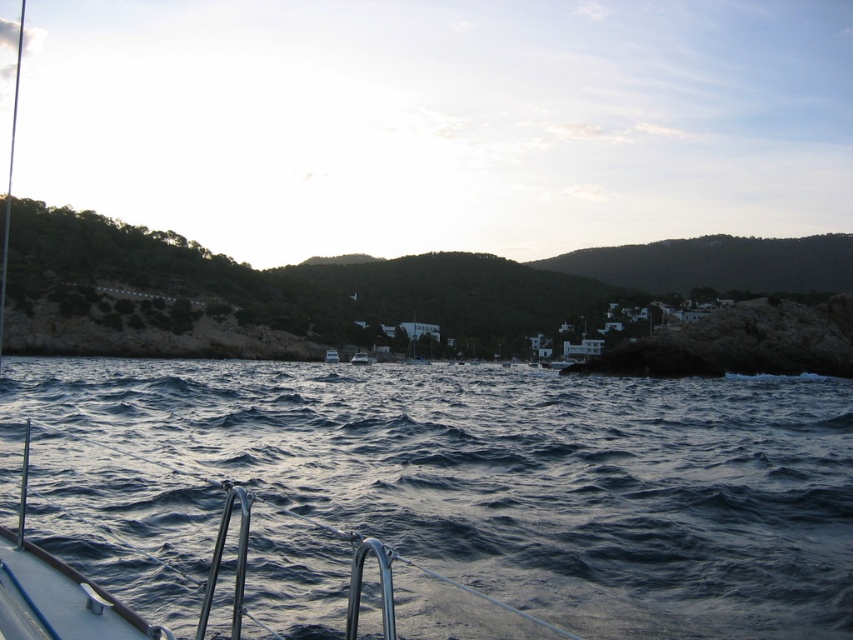
Is point (508, 340) behind point (329, 353)?

Yes, point (508, 340) is behind point (329, 353).

Which is in front, point (491, 312) or point (325, 355)?

Point (325, 355) is more forward.

At what (x,y) coordinates should I click in order to perform the action: click on green grassy hill at upper center. Please return your answer as a coordinate pair (x, y). The height and width of the screenshot is (640, 853). Looking at the image, I should click on (347, 289).

Which of these two, dark blue water at center or green grassy hill at upper center, stands taller?

green grassy hill at upper center is taller.

What are the coordinates of `dark blue water at center` in the screenshot? It's located at (x=512, y=476).

Locate an element on the screen. This screenshot has height=640, width=853. dark blue water at center is located at coordinates (512, 476).

Can you confirm if white glossy boat at center is positioned above metallic silver boat at center?

No, white glossy boat at center is not above metallic silver boat at center.

Consider the image. Which is more to the right, white glossy boat at center or metallic silver boat at center?

From the viewer's perspective, white glossy boat at center appears more on the right side.

Does point (366, 362) lie in front of point (329, 353)?

Yes.

At what (x,y) coordinates should I click in order to perform the action: click on white glossy boat at center. Please return your answer as a coordinate pair (x, y). The width and height of the screenshot is (853, 640). Looking at the image, I should click on pos(361,358).